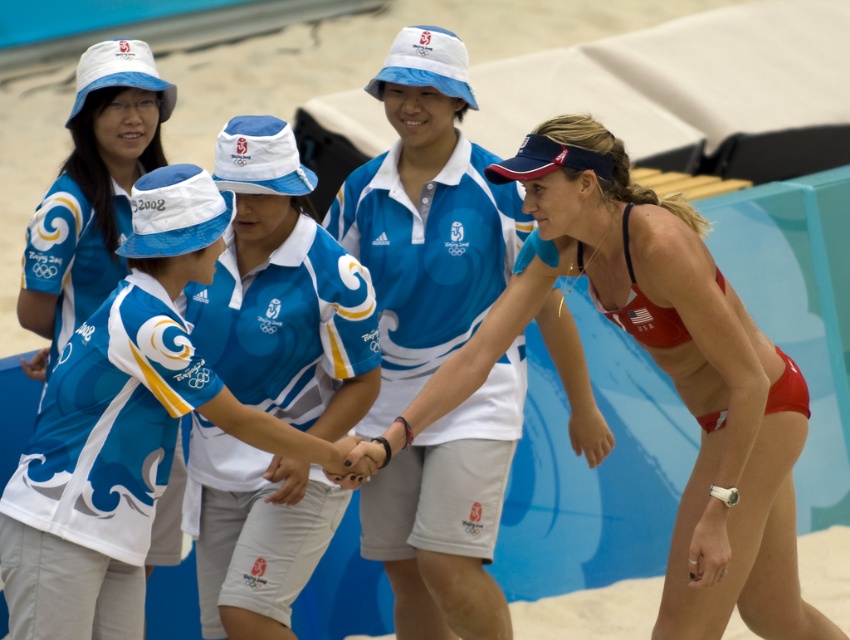
You are a photographer at the Beijing 2008 Olympics beach volleyball event. You need to ensure that the matte red bikini at center and the white matte uniform at center are both visible in your photo. Given their widths, which one should you focus on to ensure both are fully captured without cropping?

The matte red bikini at center has a greater width than the white matte uniform at center. To ensure both are fully captured without cropping, focus on framing the photo to accommodate the wider matte red bikini at center.

Consider the image. You are a photographer at the Beijing 2008 Olympics beach volleyball event. You need to capture a photo of the white matte uniform at center and the matte blue hat at upper left. Based on their positions, which object is lower in the image?

The white matte uniform at center is positioned under the matte blue hat at upper left, so the white matte uniform at center is lower in the image.

You are standing at the center of the volleyball court and want to throw a ball to either point marked as point 1 at point [65,499] or point 2 at point [144,148]. Which point should you aim for if you want the ball to land closer to you?

You should aim for point 1 at point [65,499] because it is closer to the viewer than point 2 at point [144,148].